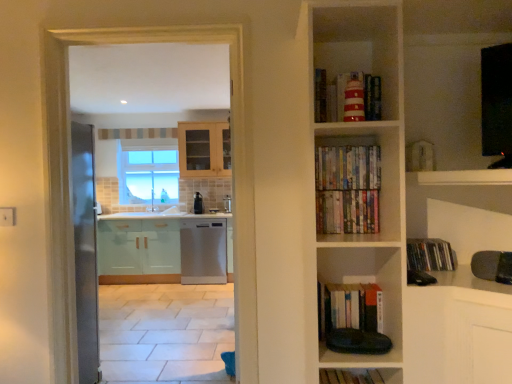
Describe the element at coordinates (350, 307) in the screenshot. I see `hardcover books at center, which is the second book from bottom to top` at that location.

What do you see at coordinates (348, 167) in the screenshot? I see `multicolored paperbacks at center, the second book in the top-to-bottom sequence` at bounding box center [348, 167].

This screenshot has width=512, height=384. What do you see at coordinates (430, 255) in the screenshot? I see `matte black book at lower right, which is counted as the third book, starting from the bottom` at bounding box center [430, 255].

The height and width of the screenshot is (384, 512). I want to click on multicolored paperbacks at center, the third book when ordered from top to bottom, so click(347, 212).

Where is `wooden book at lower center, which ranks as the first book in bottom-to-top order`? wooden book at lower center, which ranks as the first book in bottom-to-top order is located at coordinates (349, 377).

From the image's perspective, is multicolored paperbacks at center, marked as the 5th book in a bottom-to-top arrangement, above or below clear glass window at center?

multicolored paperbacks at center, marked as the 5th book in a bottom-to-top arrangement, is situated lower than clear glass window at center in the image.

Who is taller, multicolored paperbacks at center, marked as the 5th book in a bottom-to-top arrangement, or clear glass window at center?

clear glass window at center is taller.

You are a GUI agent. You are given a task and a screenshot of the screen. Output one action in this format:
    pyautogui.click(x=<x>, y=<y>)
    Task: Click on the window on the left of the multicolored paperbacks at center, marked as the 5th book in a bottom-to-top arrangement
    The width and height of the screenshot is (512, 384).
    Given the screenshot: What is the action you would take?
    pyautogui.click(x=147, y=173)

Is multicolored paperbacks at center, the second book in the top-to-bottom sequence, far away from clear glass window at center?

That's right, there is a large distance between multicolored paperbacks at center, the second book in the top-to-bottom sequence, and clear glass window at center.

From the image's perspective, is multicolored paperbacks at center, the second book in the top-to-bottom sequence, on satin black dishwasher at center?

Correct, multicolored paperbacks at center, the second book in the top-to-bottom sequence, appears higher than satin black dishwasher at center in the image.

From a real-world perspective, is multicolored paperbacks at center, the second book in the top-to-bottom sequence, above or below satin black dishwasher at center?

multicolored paperbacks at center, the second book in the top-to-bottom sequence, is situated higher than satin black dishwasher at center in the real world.

In the scene shown: Is multicolored paperbacks at center, the second book in the top-to-bottom sequence, to the left of satin black dishwasher at center from the viewer's perspective?

Incorrect, multicolored paperbacks at center, the second book in the top-to-bottom sequence, is not on the left side of satin black dishwasher at center.

Is multicolored paperbacks at center, marked as the 5th book in a bottom-to-top arrangement, looking in the opposite direction of satin black dishwasher at center?

Yes, satin black dishwasher at center is at the back of multicolored paperbacks at center, marked as the 5th book in a bottom-to-top arrangement.

Would you consider satin white dishwasher at center to be distant from satin black dishwasher at center?

No, satin white dishwasher at center is not far from satin black dishwasher at center.

In the scene shown: Looking at the image, does satin white dishwasher at center seem bigger or smaller compared to satin black dishwasher at center?

Clearly, satin white dishwasher at center is larger in size than satin black dishwasher at center.

Is satin white dishwasher at center positioned beyond the bounds of satin black dishwasher at center?

satin white dishwasher at center is positioned outside satin black dishwasher at center.

Between satin white dishwasher at center and satin black dishwasher at center, which one appears on the left side from the viewer's perspective?

satin black dishwasher at center is more to the left.

This screenshot has width=512, height=384. I want to click on window behind the striped paper lighthouse at upper center, the first book when ordered from top to bottom, so click(x=147, y=173).

From a real-world perspective, is striped paper lighthouse at upper center, which is the 6th book in bottom-to-top order, positioned above or below clear glass window at center?

striped paper lighthouse at upper center, which is the 6th book in bottom-to-top order, is situated higher than clear glass window at center in the real world.

Would you say striped paper lighthouse at upper center, the first book when ordered from top to bottom, is to the left or to the right of clear glass window at center in the picture?

Based on their positions, striped paper lighthouse at upper center, the first book when ordered from top to bottom, is located to the right of clear glass window at center.

Consider the image. Considering the relative sizes of wooden book at lower center, which ranks as the first book in bottom-to-top order, and multicolored paperbacks at center, which is the 4th book from bottom to top, in the image provided, is wooden book at lower center, which ranks as the first book in bottom-to-top order, taller than multicolored paperbacks at center, which is the 4th book from bottom to top,?

In fact, wooden book at lower center, which ranks as the first book in bottom-to-top order, may be shorter than multicolored paperbacks at center, which is the 4th book from bottom to top.

From the image's perspective, is wooden book at lower center, which is the sixth book in top-to-bottom order, located above or below multicolored paperbacks at center, the third book when ordered from top to bottom?

Clearly, from the image's perspective, wooden book at lower center, which is the sixth book in top-to-bottom order, is below multicolored paperbacks at center, the third book when ordered from top to bottom.

Considering the sizes of objects wooden book at lower center, which ranks as the first book in bottom-to-top order, and multicolored paperbacks at center, the third book when ordered from top to bottom, in the image provided, who is bigger, wooden book at lower center, which ranks as the first book in bottom-to-top order, or multicolored paperbacks at center, the third book when ordered from top to bottom,?

Bigger between the two is multicolored paperbacks at center, the third book when ordered from top to bottom.

Relative to multicolored paperbacks at center, the third book when ordered from top to bottom, is wooden book at lower center, which ranks as the first book in bottom-to-top order, in front or behind?

Clearly, wooden book at lower center, which ranks as the first book in bottom-to-top order, is in front of multicolored paperbacks at center, the third book when ordered from top to bottom.

Is wooden book at lower center, which is the sixth book in top-to-bottom order, at the back of hardcover books at center, the fifth book in the top-to-bottom sequence?

No, hardcover books at center, the fifth book in the top-to-bottom sequence, is not facing the opposite direction of wooden book at lower center, which is the sixth book in top-to-bottom order.

Can you confirm if hardcover books at center, which is the second book from bottom to top, is shorter than wooden book at lower center, which ranks as the first book in bottom-to-top order?

Incorrect, the height of hardcover books at center, which is the second book from bottom to top, does not fall short of that of wooden book at lower center, which ranks as the first book in bottom-to-top order.

Does point (339, 305) lie behind point (342, 373)?

Yes, it is behind point (342, 373).

Does point (200, 205) appear closer or farther from the camera than point (321, 97)?

Point (200, 205).

Is satin black dishwasher at center positioned with its back to striped paper lighthouse at upper center, which is the 6th book in bottom-to-top order?

That's not correct — satin black dishwasher at center is not looking away from striped paper lighthouse at upper center, which is the 6th book in bottom-to-top order.

Which object is closer to the camera taking this photo, satin black dishwasher at center or striped paper lighthouse at upper center, which is the 6th book in bottom-to-top order?

striped paper lighthouse at upper center, which is the 6th book in bottom-to-top order, is in front.

Find the location of a particular element. The width and height of the screenshot is (512, 384). the 1st book to the right of the clear glass window at center, starting your count from the anchor is located at coordinates (348, 167).

This screenshot has width=512, height=384. I want to click on appliance that is below the multicolored paperbacks at center, the second book in the top-to-bottom sequence (from the image's perspective), so click(198, 203).

Estimate the real-world distances between objects in this image. Which object is further from satin white dishwasher at center, hardcover books at center, which is the second book from bottom to top, or satin black dishwasher at center?

Among the two, hardcover books at center, which is the second book from bottom to top, is located further to satin white dishwasher at center.

When comparing their distances from multicolored paperbacks at center, the second book in the top-to-bottom sequence, does satin white dishwasher at center or satin black dishwasher at center seem closer?

satin white dishwasher at center lies closer to multicolored paperbacks at center, the second book in the top-to-bottom sequence, than the other object.

From the image, which object appears to be farther from wooden book at lower center, which is the sixth book in top-to-bottom order, striped paper lighthouse at upper center, the first book when ordered from top to bottom, or hardcover books at center, the fifth book in the top-to-bottom sequence?

striped paper lighthouse at upper center, the first book when ordered from top to bottom.

From the image, which object appears to be nearer to clear glass window at center, satin white dishwasher at center or wooden book at lower center, which is the sixth book in top-to-bottom order?

satin white dishwasher at center.

Considering their positions, is matte black book at lower right, which is counted as the third book, starting from the bottom, positioned further to satin black dishwasher at center than multicolored paperbacks at center, marked as the 5th book in a bottom-to-top arrangement?

Based on the image, matte black book at lower right, which is counted as the third book, starting from the bottom, appears to be further to satin black dishwasher at center.

When comparing their distances from multicolored paperbacks at center, which is the 4th book from bottom to top, does hardcover books at center, the fifth book in the top-to-bottom sequence, or multicolored paperbacks at center, marked as the 5th book in a bottom-to-top arrangement, seem closer?

multicolored paperbacks at center, marked as the 5th book in a bottom-to-top arrangement.

When comparing their distances from matte black book at lower right, the fourth book positioned from the top, does striped paper lighthouse at upper center, the first book when ordered from top to bottom, or wooden book at lower center, which ranks as the first book in bottom-to-top order, seem closer?

The object closer to matte black book at lower right, the fourth book positioned from the top, is wooden book at lower center, which ranks as the first book in bottom-to-top order.

When comparing their distances from multicolored paperbacks at center, which is the 4th book from bottom to top, does multicolored paperbacks at center, marked as the 5th book in a bottom-to-top arrangement, or striped paper lighthouse at upper center, the first book when ordered from top to bottom, seem further?

striped paper lighthouse at upper center, the first book when ordered from top to bottom.

The width and height of the screenshot is (512, 384). Identify the location of appliance between clear glass window at center and satin white dishwasher at center in the up-down direction. (198, 203).

At what (x,y) coordinates should I click in order to perform the action: click on book between multicolored paperbacks at center, which is the 4th book from bottom to top, and clear glass window at center, along the z-axis. Please return your answer as a coordinate pair (x, y). This screenshot has width=512, height=384. Looking at the image, I should click on (430, 255).

This screenshot has height=384, width=512. I want to click on dish washer between wooden book at lower center, which ranks as the first book in bottom-to-top order, and satin black dishwasher at center in the front-back direction, so click(203, 251).

At what (x,y) coordinates should I click in order to perform the action: click on appliance located between striped paper lighthouse at upper center, the first book when ordered from top to bottom, and clear glass window at center in the depth direction. Please return your answer as a coordinate pair (x, y). Looking at the image, I should click on tap(198, 203).